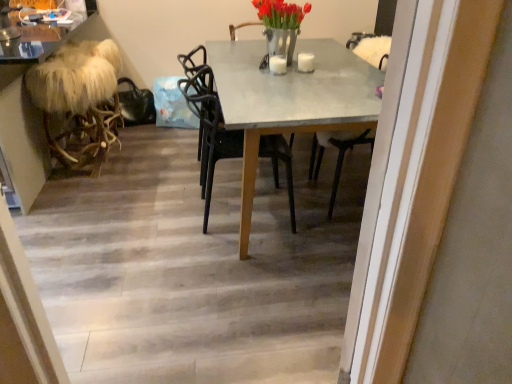
The width and height of the screenshot is (512, 384). Identify the location of free space to the left of black plastic chair at center. (150, 208).